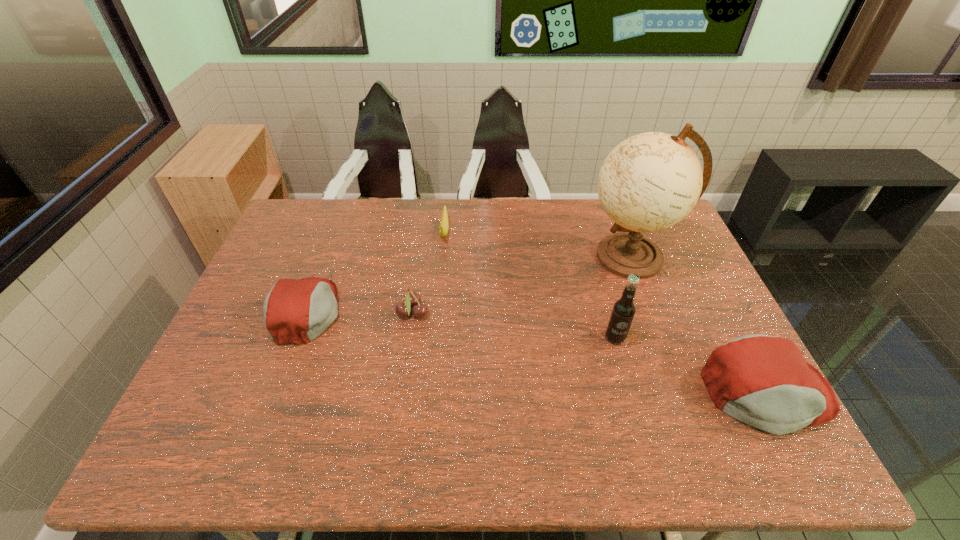
Image resolution: width=960 pixels, height=540 pixels. I want to click on empty location between the tallest object and the third object from left to right, so click(538, 244).

At what (x,y) coordinates should I click in order to perform the action: click on unoccupied area between the globe and the right cap. Please return your answer as a coordinate pair (x, y). Looking at the image, I should click on (699, 325).

Where is `vacant space that's between the globe and the second object from left to right`? The width and height of the screenshot is (960, 540). vacant space that's between the globe and the second object from left to right is located at coordinates (522, 285).

At what (x,y) coordinates should I click in order to perform the action: click on free spot between the cherry and the fourth tallest object. Please return your answer as a coordinate pair (x, y). Looking at the image, I should click on (360, 313).

Where is `vacant area that lies between the second tallest object and the shortest object`? The height and width of the screenshot is (540, 960). vacant area that lies between the second tallest object and the shortest object is located at coordinates (530, 285).

You are a GUI agent. You are given a task and a screenshot of the screen. Output one action in this format:
    pyautogui.click(x=<x>, y=<y>)
    Task: Click on the free space between the cherry and the shortest object
    Image resolution: width=960 pixels, height=540 pixels.
    Given the screenshot: What is the action you would take?
    pyautogui.click(x=428, y=272)

Locate an element on the screen. free spot between the globe and the left cap is located at coordinates (468, 284).

Locate an element on the screen. vacant region between the fifth object from right to left and the left cap is located at coordinates (360, 313).

Find the location of a particular element. The image size is (960, 540). free spot between the fourth object from right to left and the leftmost object is located at coordinates (375, 272).

This screenshot has width=960, height=540. I want to click on the closest object relative to the third shortest object, so click(412, 299).